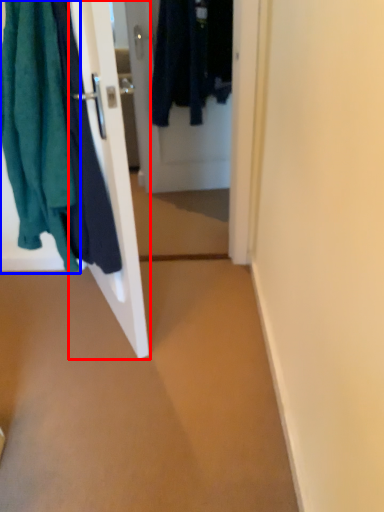
Question: Which of the following is the closest to the observer, door (highlighted by a red box) or towel (highlighted by a blue box)?

Choices:
 (A) door
 (B) towel

Answer: (B)